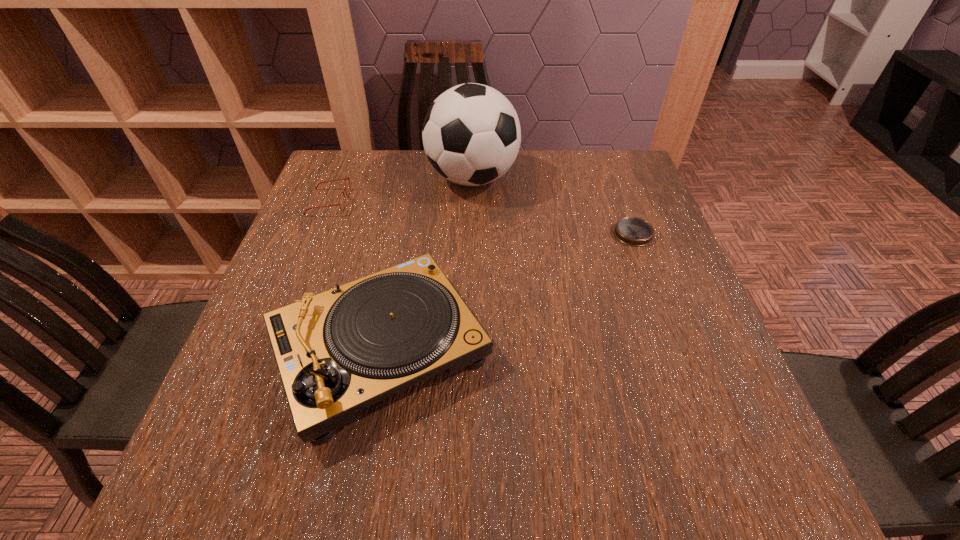
Identify the location of soccer ball. (471, 134).

What are the coordinates of `the third shortest object` in the screenshot? It's located at (338, 352).

Identify the location of the nearest object. (338, 352).

At what (x,y) coordinates should I click in order to perform the action: click on spectacles. Please return your answer as a coordinate pair (x, y). The height and width of the screenshot is (540, 960). Looking at the image, I should click on (347, 178).

Where is `the third farthest object`? the third farthest object is located at coordinates (632, 231).

Find the location of a particular element. This screenshot has width=960, height=540. compass is located at coordinates (632, 231).

Image resolution: width=960 pixels, height=540 pixels. I want to click on vacant region located 0.120m on the front of the tallest object, so click(x=471, y=237).

This screenshot has height=540, width=960. Identify the location of vacant area situated 0.170m on the right of the record player. (583, 349).

At what (x,y) coordinates should I click in order to perform the action: click on vacant space positioned 0.380m on the face of the spectacles. Please return your answer as a coordinate pair (x, y). The image size is (960, 540). Looking at the image, I should click on (493, 202).

Where is `vacant area situated on the front of the compass`? The width and height of the screenshot is (960, 540). vacant area situated on the front of the compass is located at coordinates (655, 291).